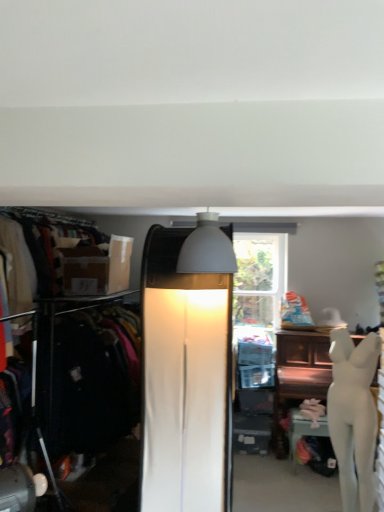
Question: Considering the relative sizes of white glossy mannequin at lower right and matte white lamp at center, the first lamp in the bottom-to-top sequence, in the image provided, is white glossy mannequin at lower right shorter than matte white lamp at center, the first lamp in the bottom-to-top sequence,?

Choices:
 (A) yes
 (B) no

Answer: (A)

Question: Considering the relative positions of white glossy mannequin at lower right and matte white lamp at center, the first lamp in the bottom-to-top sequence, in the image provided, is white glossy mannequin at lower right to the left of matte white lamp at center, the first lamp in the bottom-to-top sequence, from the viewer's perspective?

Choices:
 (A) no
 (B) yes

Answer: (A)

Question: Is white glossy mannequin at lower right turned away from matte white lamp at center, the second lamp viewed from the top?

Choices:
 (A) no
 (B) yes

Answer: (A)

Question: Is white glossy mannequin at lower right aimed at matte white lamp at center, the second lamp viewed from the top?

Choices:
 (A) yes
 (B) no

Answer: (B)

Question: From the image's perspective, would you say white glossy mannequin at lower right is positioned over matte white lamp at center, which ranks as the 1th lamp in back-to-front order?

Choices:
 (A) yes
 (B) no

Answer: (B)

Question: Would you say matte white lamp at center, the second lamp viewed from the top, is part of white glossy mannequin at lower right's contents?

Choices:
 (A) no
 (B) yes

Answer: (A)

Question: Are matte white lamp at center, which is the 2th lamp from front to back, and white glossy statue at right far apart?

Choices:
 (A) no
 (B) yes

Answer: (B)

Question: Can you confirm if matte white lamp at center, the second lamp viewed from the top, is wider than white glossy statue at right?

Choices:
 (A) yes
 (B) no

Answer: (A)

Question: Considering the relative sizes of matte white lamp at center, the second lamp viewed from the top, and white glossy statue at right in the image provided, is matte white lamp at center, the second lamp viewed from the top, thinner than white glossy statue at right?

Choices:
 (A) no
 (B) yes

Answer: (A)

Question: From a real-world perspective, is matte white lamp at center, the second lamp viewed from the top, under white glossy statue at right?

Choices:
 (A) yes
 (B) no

Answer: (B)

Question: Can you confirm if matte white lamp at center, the first lamp in the bottom-to-top sequence, is smaller than white glossy statue at right?

Choices:
 (A) no
 (B) yes

Answer: (A)

Question: Does matte white lamp at center, the first lamp in the bottom-to-top sequence, lie behind white glossy statue at right?

Choices:
 (A) yes
 (B) no

Answer: (B)

Question: Is white glossy mannequin at lower right positioned before matte brown box at left?

Choices:
 (A) no
 (B) yes

Answer: (B)